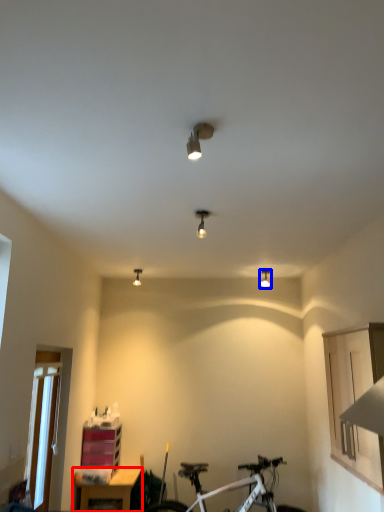
Question: Which point is further to the camera, table (highlighted by a red box) or light fixture (highlighted by a blue box)?

Choices:
 (A) table
 (B) light fixture

Answer: (B)